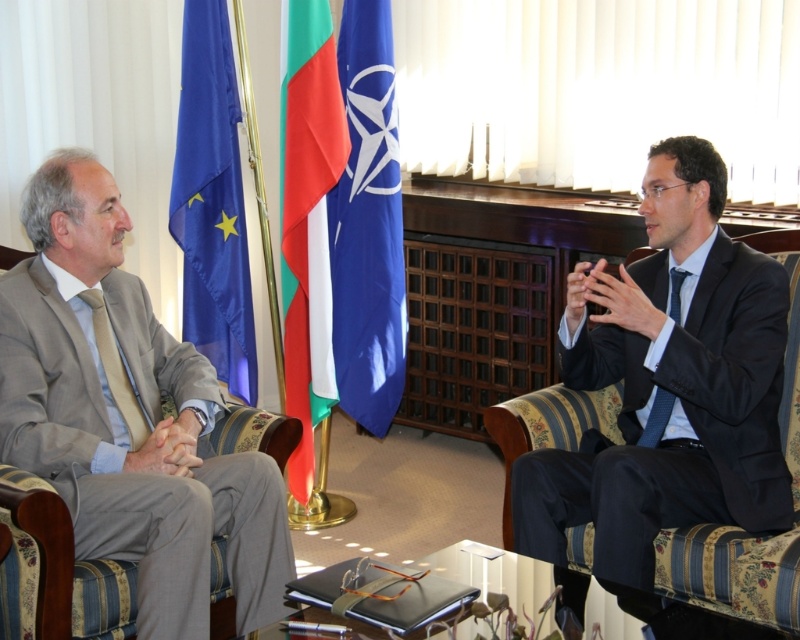
You are attending a formal meeting in an office with two people sitting across each other. There is a point marked at coordinates (x=212, y=202). What object is located at this point?

The point at coordinates (x=212, y=202) indicates the location of the blue fabric flag at left.

You are attending a diplomatic meeting and notice two items of interest in the scene. The blue fabric flag at center and the beige fabric tie at left. Which item is positioned higher in the image?

The blue fabric flag at center is located above the beige fabric tie at left, so it is positioned higher in the image.

You are a diplomat who needs to place a 10 inch wide document between the blue fabric flag at center and the bright red fabric flag at center. Will the document fit between them?

The blue fabric flag at center is 8.93 inches away from the bright red fabric flag at center. Since the document is 10 inches wide, it will not fit between them as the space is narrower than the document.